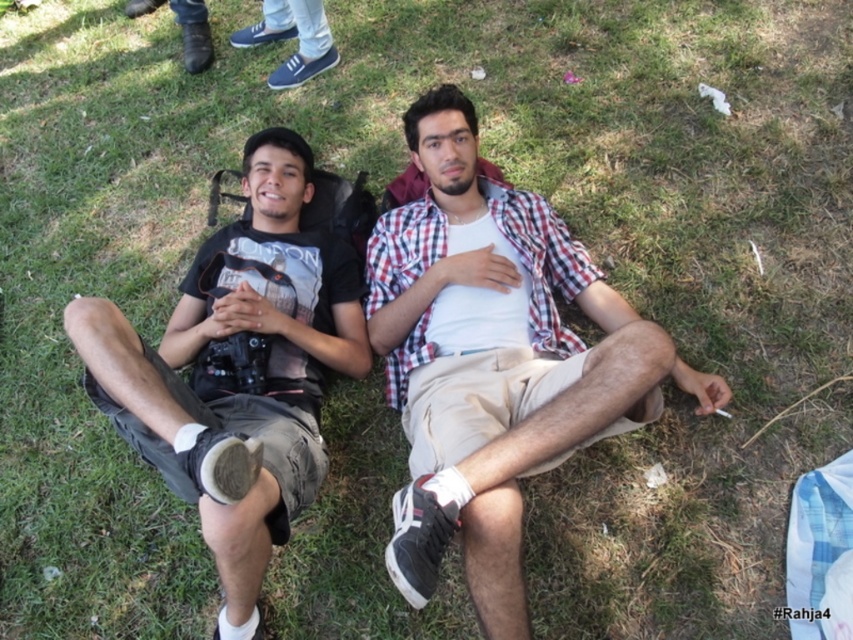
Can you confirm if checkered fabric shirt at center is taller than matte black t-shirt at center?

Incorrect, checkered fabric shirt at center's height is not larger of matte black t-shirt at center's.

Describe the element at coordinates (494, 360) in the screenshot. I see `checkered fabric shirt at center` at that location.

Find the location of a particular element. checkered fabric shirt at center is located at coordinates [x=494, y=360].